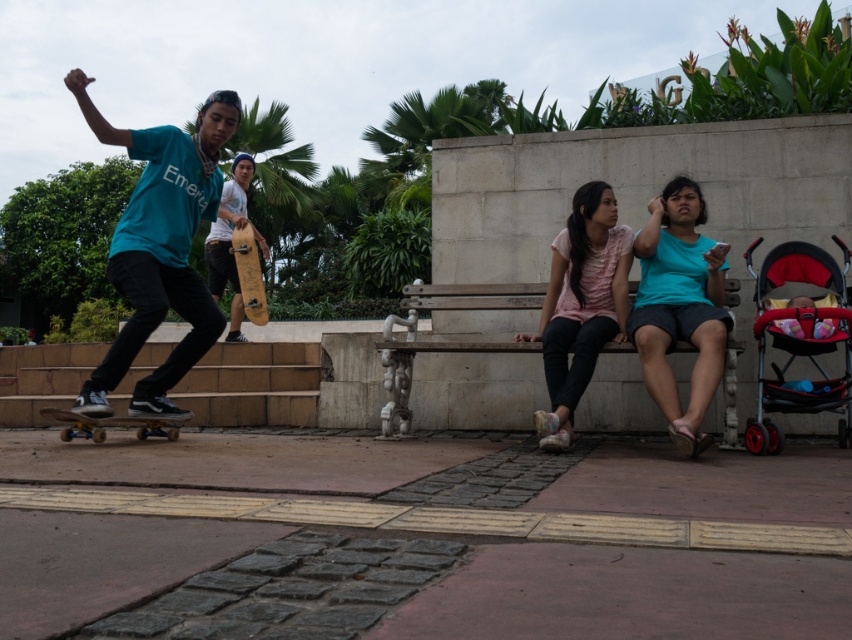
You are standing at the center of the park. Which direction should you walk to reach the teal matte shirt at left?

You should walk to the left from the center of the park to reach the teal matte shirt at left since it is located at point (159, 248) which is on the left side of the image.